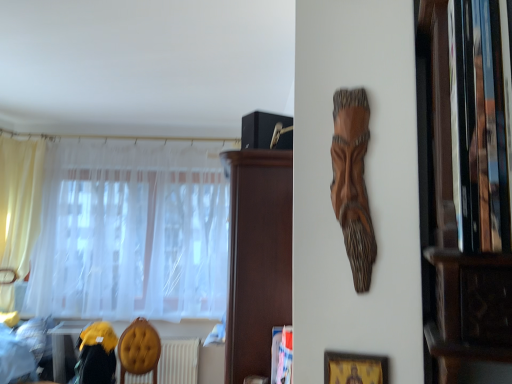
Question: Are wooden carving at upper center and yellow fabric at lower left far apart?

Choices:
 (A) yes
 (B) no

Answer: (A)

Question: Is yellow fabric at lower left surrounded by wooden carving at upper center?

Choices:
 (A) yes
 (B) no

Answer: (B)

Question: Could you tell me if wooden carving at upper center is facing yellow fabric at lower left?

Choices:
 (A) yes
 (B) no

Answer: (B)

Question: Is wooden carving at upper center in front of yellow fabric at lower left?

Choices:
 (A) no
 (B) yes

Answer: (B)

Question: From a real-world perspective, is wooden carving at upper center under yellow fabric at lower left?

Choices:
 (A) no
 (B) yes

Answer: (A)

Question: Is wooden carving at upper center further to camera compared to yellow fabric at lower left?

Choices:
 (A) no
 (B) yes

Answer: (A)

Question: Is wooden carving at upper center smaller than gold textured picture frame at lower right?

Choices:
 (A) yes
 (B) no

Answer: (B)

Question: Does wooden carving at upper center appear on the left side of gold textured picture frame at lower right?

Choices:
 (A) yes
 (B) no

Answer: (B)

Question: Can you confirm if wooden carving at upper center is thinner than gold textured picture frame at lower right?

Choices:
 (A) yes
 (B) no

Answer: (B)

Question: Is gold textured picture frame at lower right completely or partially inside wooden carving at upper center?

Choices:
 (A) no
 (B) yes

Answer: (A)

Question: From the image's perspective, is wooden carving at upper center located above gold textured picture frame at lower right?

Choices:
 (A) no
 (B) yes

Answer: (B)

Question: Is wooden carving at upper center bigger than gold textured picture frame at lower right?

Choices:
 (A) yes
 (B) no

Answer: (A)

Question: Is yellow sheer curtain at left, which appears as the 1th curtain when viewed from the left, closer to the viewer compared to yellow fabric armchair at lower left?

Choices:
 (A) no
 (B) yes

Answer: (A)